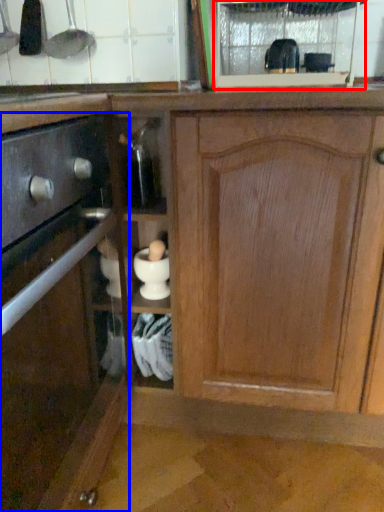
Question: Which object is further to the camera taking this photo, glass door (highlighted by a red box) or cabinetry (highlighted by a blue box)?

Choices:
 (A) glass door
 (B) cabinetry

Answer: (A)